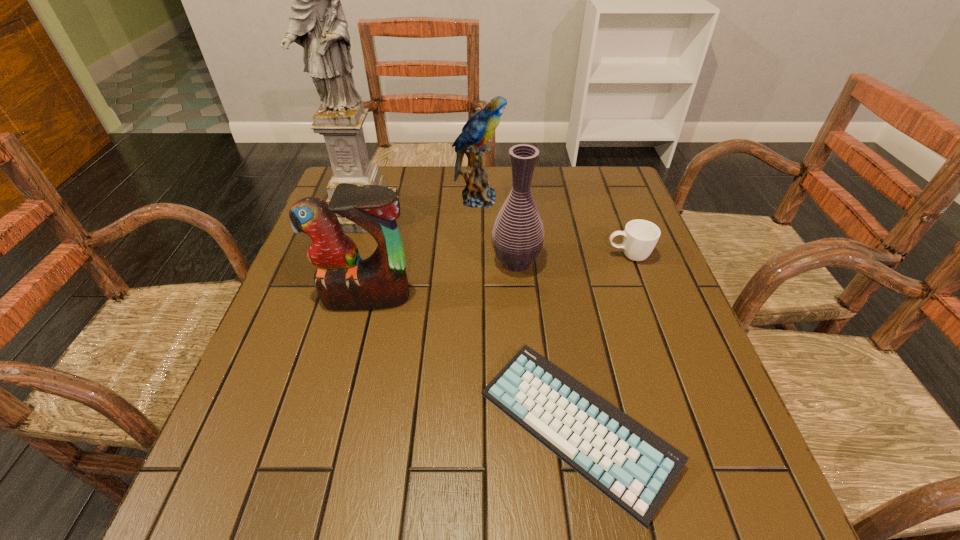
Identify which object is the second nearest to the second shortest object. Please provide its 2D coordinates. Your answer should be formatted as a tuple, i.e. [(x, y)], where the tuple contains the x and y coordinates of a point satisfying the conditions above.

[(632, 466)]

Locate an element on the screen. object that ranks as the fifth closest to the vase is located at coordinates (317, 23).

You are a GUI agent. You are given a task and a screenshot of the screen. Output one action in this format:
    pyautogui.click(x=<x>, y=<y>)
    Task: Click on the free space in the image that satisfies the following two spatial constraints: 1. on the face of the farther parrot; 2. on the front-facing side of the sculpture
    
    Given the screenshot: What is the action you would take?
    pyautogui.click(x=478, y=213)

Find the location of a particular element. Image resolution: width=960 pixels, height=540 pixels. free region that satisfies the following two spatial constraints: 1. on the front-facing side of the sculpture; 2. on the right side of the nearest object is located at coordinates (292, 428).

Locate an element on the screen. The width and height of the screenshot is (960, 540). free space that satisfies the following two spatial constraints: 1. on the face of the computer keyboard; 2. on the left side of the right parrot is located at coordinates (476, 428).

Where is `free space that satisfies the following two spatial constraints: 1. on the front-facing side of the sculpture; 2. on the left side of the vase`? The image size is (960, 540). free space that satisfies the following two spatial constraints: 1. on the front-facing side of the sculpture; 2. on the left side of the vase is located at coordinates (346, 262).

Locate an element on the screen. The height and width of the screenshot is (540, 960). vacant space that satisfies the following two spatial constraints: 1. on the face of the right parrot; 2. at the face of the fifth farthest object is located at coordinates click(x=477, y=298).

Find the location of a particular element. The height and width of the screenshot is (540, 960). free location that satisfies the following two spatial constraints: 1. on the front-facing side of the vase; 2. on the right side of the sculpture is located at coordinates (346, 262).